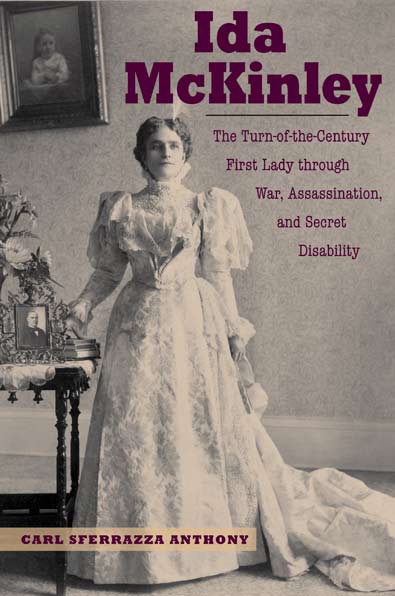
At what (x,y) coordinates should I click in order to perform the action: click on right front table leg. Please return your answer as a coordinate pair (x, y). The image size is (395, 596). Looking at the image, I should click on (62, 482).